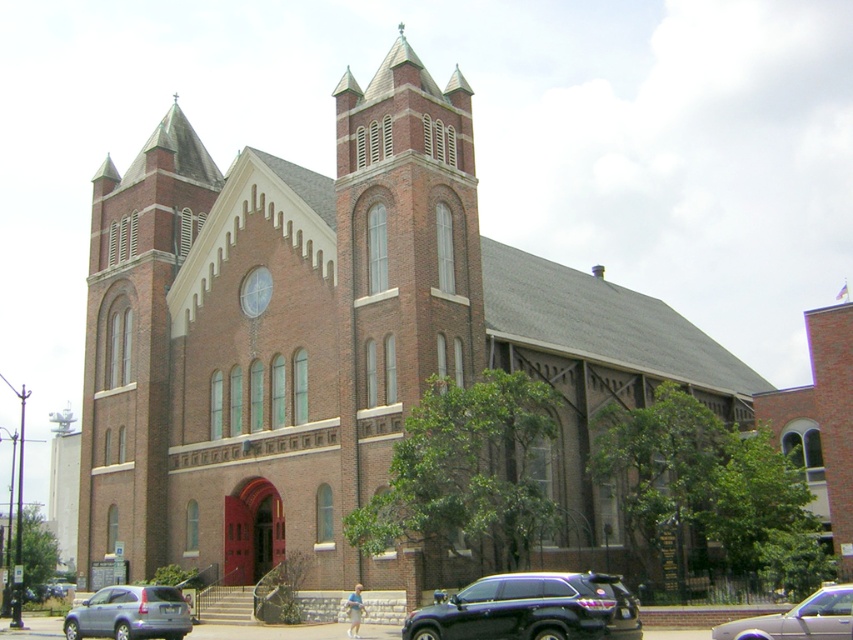
Question: Which is farther from the black matte suv at lower center?

Choices:
 (A) metallic silver sedan at lower right
 (B) metallic gray suv at lower left

Answer: (B)

Question: Which point is closer to the camera?

Choices:
 (A) (68, 627)
 (B) (527, 598)
 (C) (837, 609)

Answer: (C)

Question: Can you confirm if metallic gray suv at lower left is smaller than metallic silver sedan at lower right?

Choices:
 (A) yes
 (B) no

Answer: (B)

Question: Which object is closer to the camera taking this photo?

Choices:
 (A) black matte suv at lower center
 (B) metallic gray suv at lower left

Answer: (A)

Question: Is black matte suv at lower center positioned before metallic silver sedan at lower right?

Choices:
 (A) yes
 (B) no

Answer: (B)

Question: Is black matte suv at lower center in front of metallic silver sedan at lower right?

Choices:
 (A) yes
 (B) no

Answer: (B)